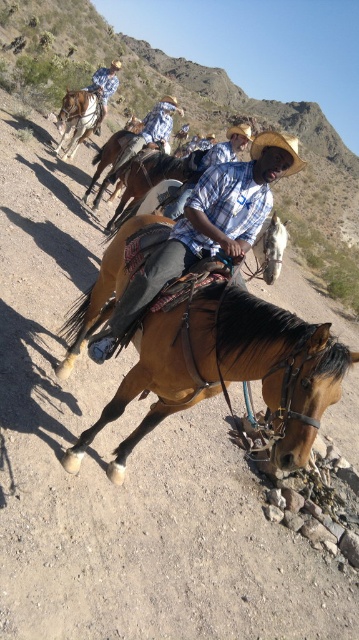
You are a photographer trying to capture the rider and his horse. The camera can only focus on objects within a certain height range. The brown leather saddle at center and the matte blue plaid shirt at center are both in the frame. Which object should you adjust the focus on if the saddle is too tall for the camera to focus properly?

The brown leather saddle at center is much taller than the matte blue plaid shirt at center, so you should adjust the focus to the matte blue plaid shirt at center since it is within the camera height range.

You are a photographer standing in front of the scene. You want to take a photo focusing on the brown leather saddle at center and the light blue plaid shirt at center. Which object should you adjust your focus on first if you want to capture both in sharp detail?

The brown leather saddle at center is closer to the viewer than the light blue plaid shirt at center. To capture both in sharp detail, you should focus on the brown leather saddle at center first, as it is closer, and the light blue plaid shirt at center will fall into the depth of field range if the saddle is in focus.

You are a photographer standing at the edge of the dirt path. You want to take a photo of the brown leather saddle at center and the light blue plaid shirt at center in the same frame. Given that your camera has a maximum focus range of 10 meters, will both subjects be in focus?

The distance between the brown leather saddle at center and the light blue plaid shirt at center is 10.75 meters, which exceeds the camera focus range of 10 meters. Therefore, both subjects cannot be in focus simultaneously.